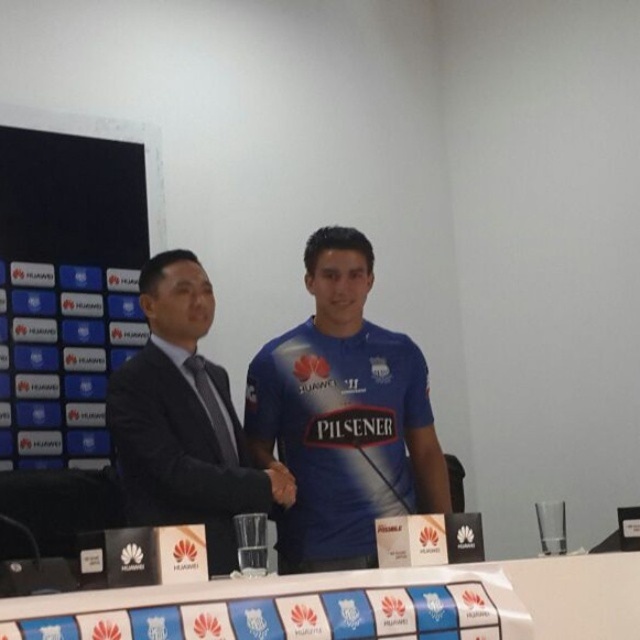
Question: Does blue jersey at center come in front of dark blue suit at center?

Choices:
 (A) no
 (B) yes

Answer: (A)

Question: Which of the following is the closest to the observer?

Choices:
 (A) black matte hand at center
 (B) blue jersey at center
 (C) dark blue suit at center
 (D) white glossy table at center

Answer: (D)

Question: Among these objects, which one is farthest from the camera?

Choices:
 (A) black matte hand at center
 (B) white glossy table at center
 (C) blue jersey at center

Answer: (C)

Question: Can you confirm if blue jersey at center is positioned to the right of dark blue suit at center?

Choices:
 (A) no
 (B) yes

Answer: (B)

Question: Which object is closer to the camera taking this photo?

Choices:
 (A) blue jersey at center
 (B) white glossy table at center

Answer: (B)

Question: Is dark blue suit at center wider than black matte hand at center?

Choices:
 (A) yes
 (B) no

Answer: (A)